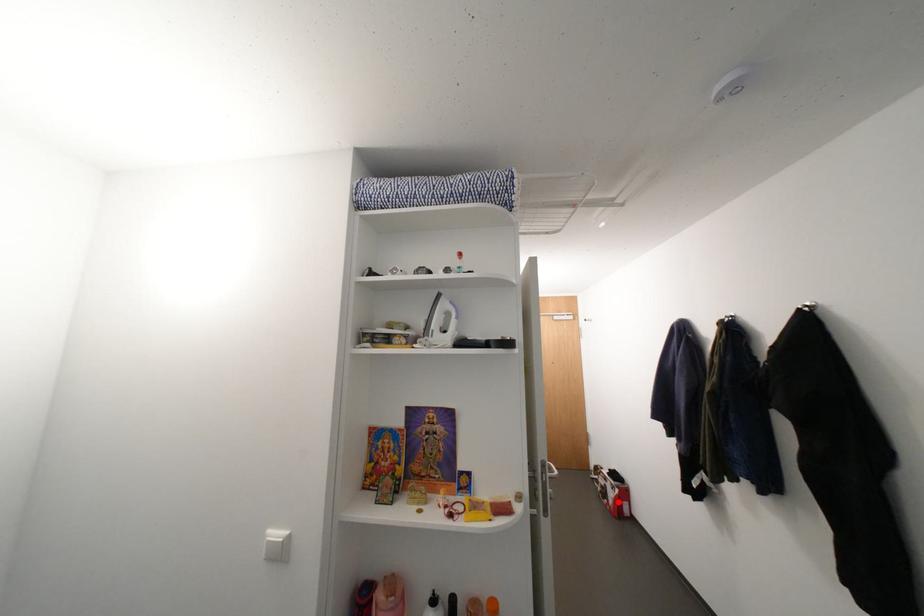
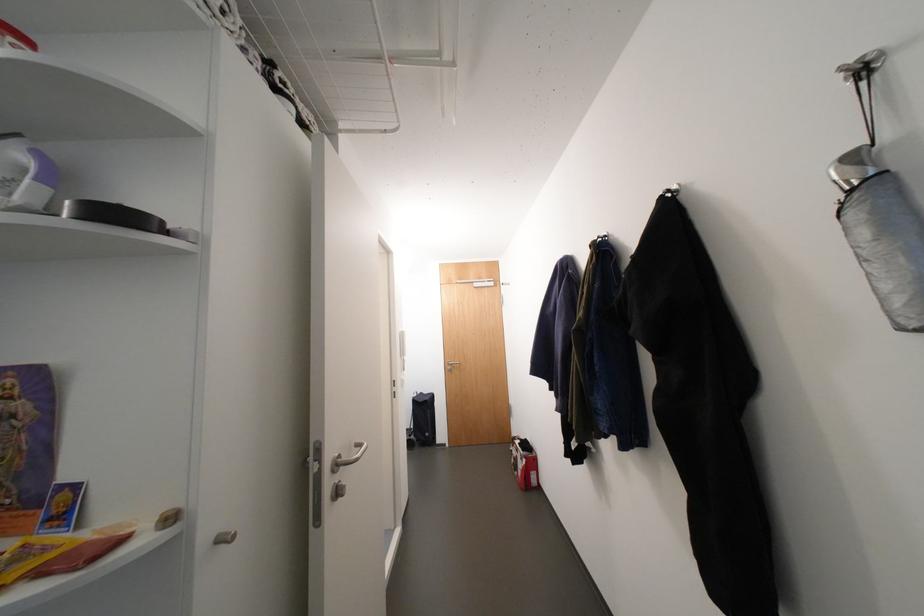
Question: I am providing you with two images of the same scene from different viewpoints. Image1 has a red point marked. In image2, the corresponding 3D location appears at what relative position? Reply with the corresponding letter.

Choices:
 (A) Closer
 (B) Farther

Answer: (B)